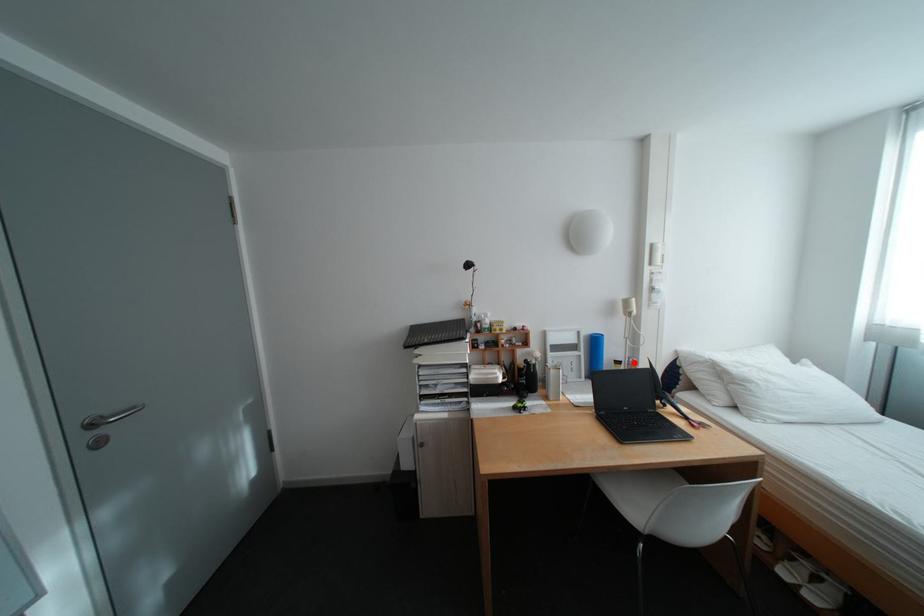
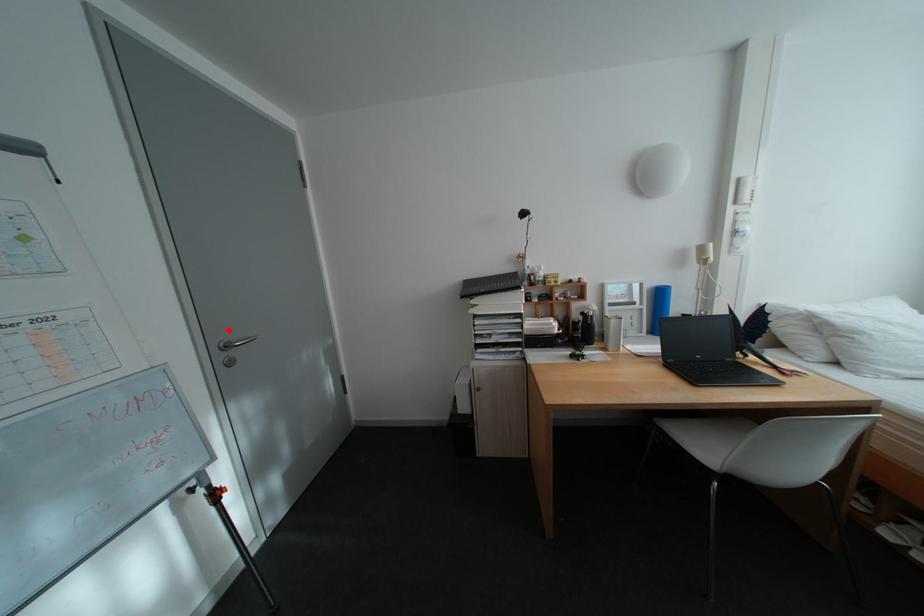
I am providing you with two images of the same scene from different viewpoints. A red point is marked on the first image and another point is marked on the second image. Does the point marked in image1 correspond to the same location as the one in image2?

No